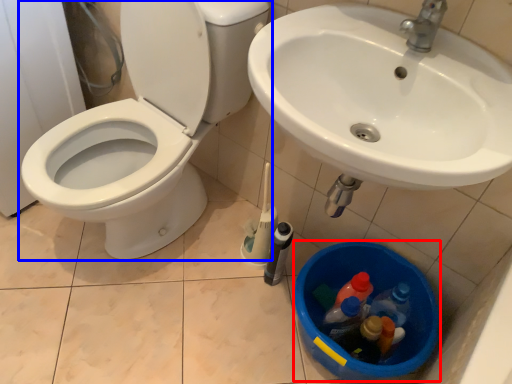
Question: Which point is closer to the camera, potty (highlighted by a red box) or toilet (highlighted by a blue box)?

Choices:
 (A) potty
 (B) toilet

Answer: (B)